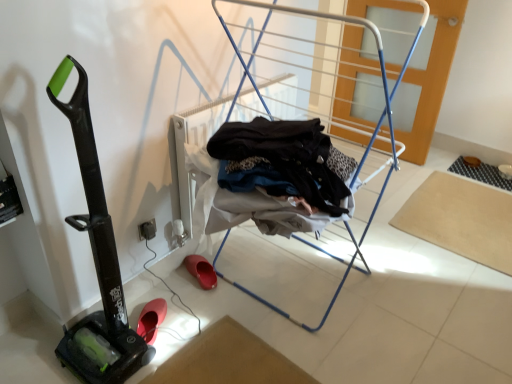
Find the location of a particular element. The width and height of the screenshot is (512, 384). vacant area that lies between black rubber vacuum at left and metallic blue drying rack at center is located at coordinates (201, 329).